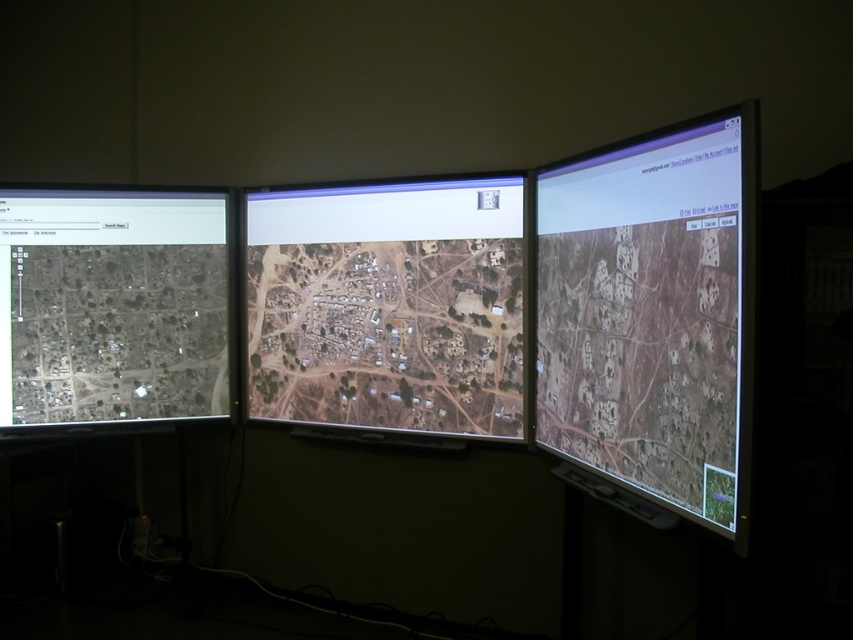
Question: Does matte black monitor at right have a smaller size compared to satellite imagery map at center?

Choices:
 (A) no
 (B) yes

Answer: (B)

Question: Which point is closer to the camera taking this photo?

Choices:
 (A) (630, 243)
 (B) (112, 292)

Answer: (A)

Question: Which point is closer to the camera taking this photo?

Choices:
 (A) pos(469,252)
 (B) pos(643,332)

Answer: (B)

Question: Is satellite imagery map at center smaller than gray matte map at left?

Choices:
 (A) no
 (B) yes

Answer: (A)

Question: Which of the following is the closest to the observer?

Choices:
 (A) satellite imagery map at center
 (B) gray matte map at left

Answer: (A)

Question: Is matte black monitor at right closer to the viewer compared to gray matte map at left?

Choices:
 (A) no
 (B) yes

Answer: (B)